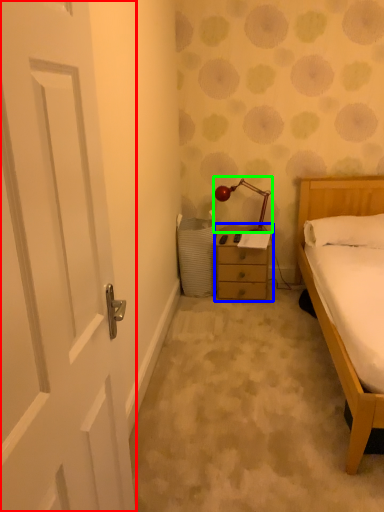
Question: Which is nearer to the door (highlighted by a red box)? nightstand (highlighted by a blue box) or lamp (highlighted by a green box).

Choices:
 (A) nightstand
 (B) lamp

Answer: (A)